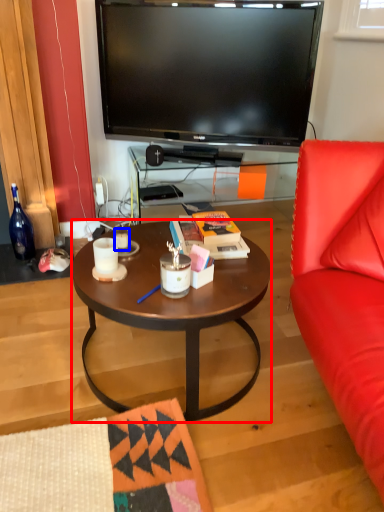
Question: Among these objects, which one is farthest to the camera, coffee table (highlighted by a red box) or coffee cup (highlighted by a blue box)?

Choices:
 (A) coffee table
 (B) coffee cup

Answer: (B)